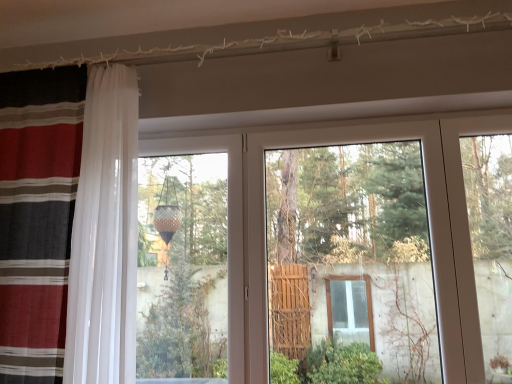
Question: From a real-world perspective, is striped fabric curtain at left physically located above or below transparent glass door at center?

Choices:
 (A) below
 (B) above

Answer: (B)

Question: From their relative heights in the image, would you say striped fabric curtain at left is taller or shorter than transparent glass door at center?

Choices:
 (A) short
 (B) tall

Answer: (B)

Question: In terms of width, does striped fabric curtain at left look wider or thinner when compared to transparent glass door at center?

Choices:
 (A) thin
 (B) wide

Answer: (B)

Question: Is transparent glass door at center inside or outside of striped fabric curtain at left?

Choices:
 (A) outside
 (B) inside

Answer: (A)

Question: From the image's perspective, is transparent glass door at center above or below striped fabric curtain at left?

Choices:
 (A) above
 (B) below

Answer: (B)

Question: Considering the positions of transparent glass door at center and striped fabric curtain at left in the image, is transparent glass door at center bigger or smaller than striped fabric curtain at left?

Choices:
 (A) big
 (B) small

Answer: (B)

Question: Based on their positions, is transparent glass door at center located to the left or right of striped fabric curtain at left?

Choices:
 (A) right
 (B) left

Answer: (A)